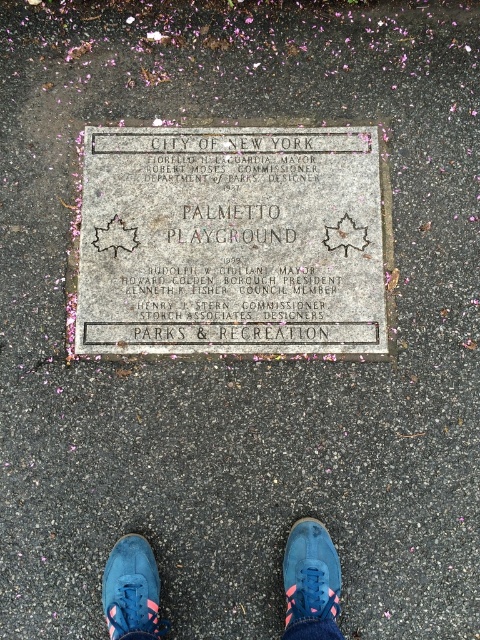
Which of these two, blue suede shoes at center or blue suede shoe at center, stands shorter?

blue suede shoes at center

Does blue suede shoes at center lie in front of blue suede shoe at center?

Yes, it is.

Does point (327, 593) come closer to viewer compared to point (317, 579)?

Yes, it is.

Where is `blue suede shoes at center`? blue suede shoes at center is located at coordinates (311, 582).

Can you confirm if gray concrete plaque at center is positioned to the right of blue suede shoe at center?

No, gray concrete plaque at center is not to the right of blue suede shoe at center.

Who is more distant from viewer, (356,131) or (333,589)?

The point (356,131) is more distant.

The image size is (480, 640). Identify the location of gray concrete plaque at center. (230, 241).

Identify the location of gray concrete plaque at center. (230, 241).

Is blue suede shoes at center wider than blue suede shoe at lower center?

Incorrect, blue suede shoes at center's width does not surpass blue suede shoe at lower center's.

Who is shorter, blue suede shoes at center or blue suede shoe at lower center?

blue suede shoe at lower center

Find the location of a particular element. This screenshot has height=640, width=480. blue suede shoes at center is located at coordinates (311, 582).